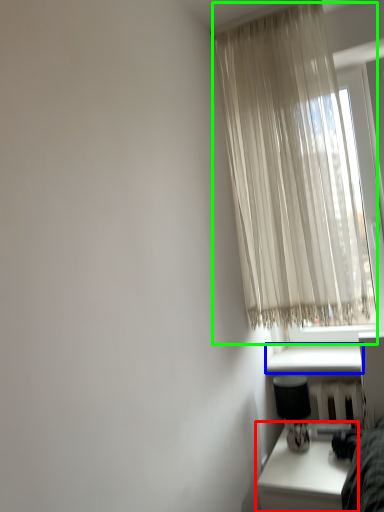
Question: Considering the real-world distances, which object is closest to table (highlighted by a red box)? window sill (highlighted by a blue box) or curtain (highlighted by a green box).

Choices:
 (A) window sill
 (B) curtain

Answer: (A)